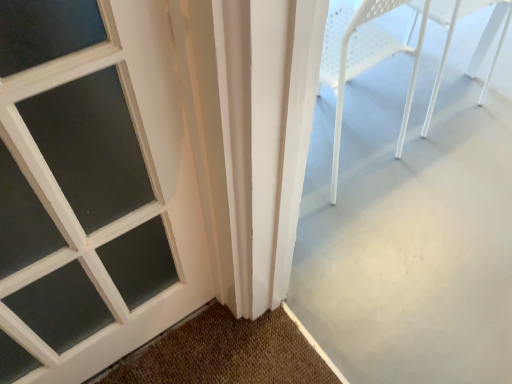
The width and height of the screenshot is (512, 384). I want to click on vacant space in white plastic chair at right (from a real-world perspective), so [417, 98].